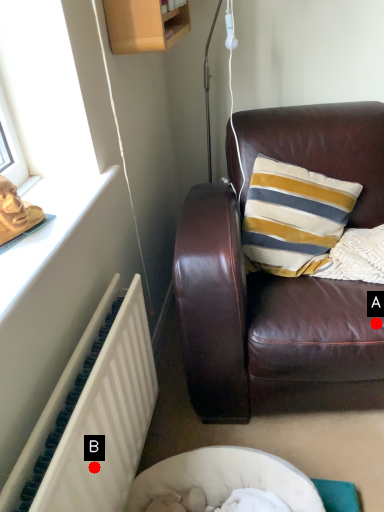
Question: Two points are circled on the image, labeled by A and B beside each circle. Which point is closer to the camera?

Choices:
 (A) A is closer
 (B) B is closer

Answer: (B)